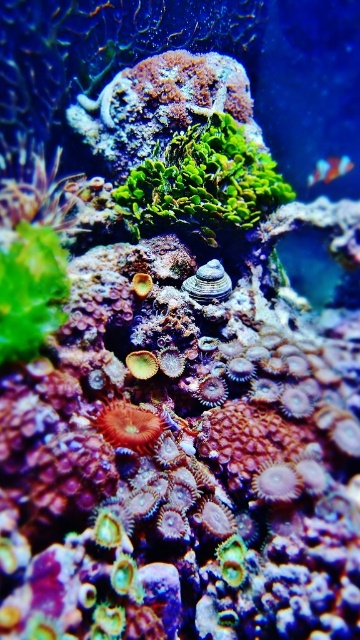
Question: Which point is closer to the camera?

Choices:
 (A) green leafy plant at left
 (B) green matte algae at center
 (C) shiny blue fish at upper right

Answer: (A)

Question: Is green leafy plant at left above shiny blue fish at upper right?

Choices:
 (A) yes
 (B) no

Answer: (B)

Question: Is green leafy plant at left closer to camera compared to red coral at center?

Choices:
 (A) yes
 (B) no

Answer: (A)

Question: Is green leafy plant at left positioned before red coral at center?

Choices:
 (A) no
 (B) yes

Answer: (B)

Question: Among these points, which one is nearest to the camera?

Choices:
 (A) (47, 307)
 (B) (317, 179)
 (C) (117, 420)

Answer: (A)

Question: Among these points, which one is farthest from the camera?

Choices:
 (A) (97, 420)
 (B) (340, 176)
 (C) (268, 170)

Answer: (B)